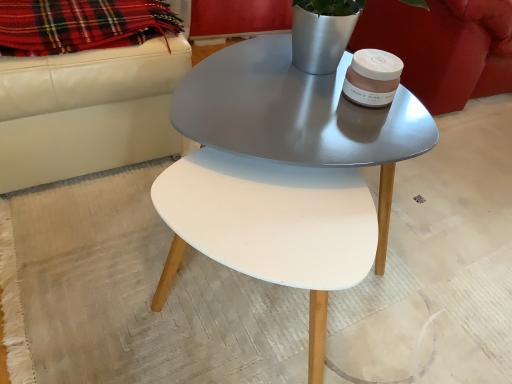
Locate an element on the screen. The image size is (512, 384). vacant area that lies to the right of metallic gray coffee table at center is located at coordinates (453, 238).